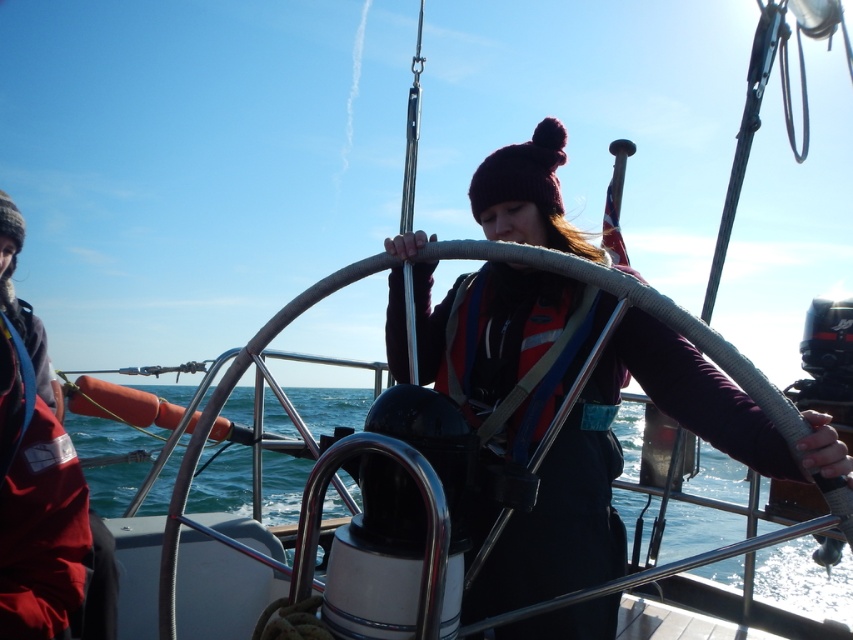
You are on a sailboat and need to secure a safety device. The matte black life vest at center and the blue water at center are both in your view. Which one is shorter in height?

The matte black life vest at center is not as tall as the blue water at center, so the life vest is shorter in height.

You are on a sailboat and need to jump into the water. Where should you jump to land in the blue water at center?

The blue water at center is located at point (705, 508), so you should jump towards that coordinate to land in the blue water at center.

You are a sailor on the deck of the sailboat and need to quickly grab either the matte black life vest at center or the red life jacket at center. Which one can you reach faster?

The matte black life vest at center is closer to the viewer than the red life jacket at center, so you can reach the matte black life vest at center faster.